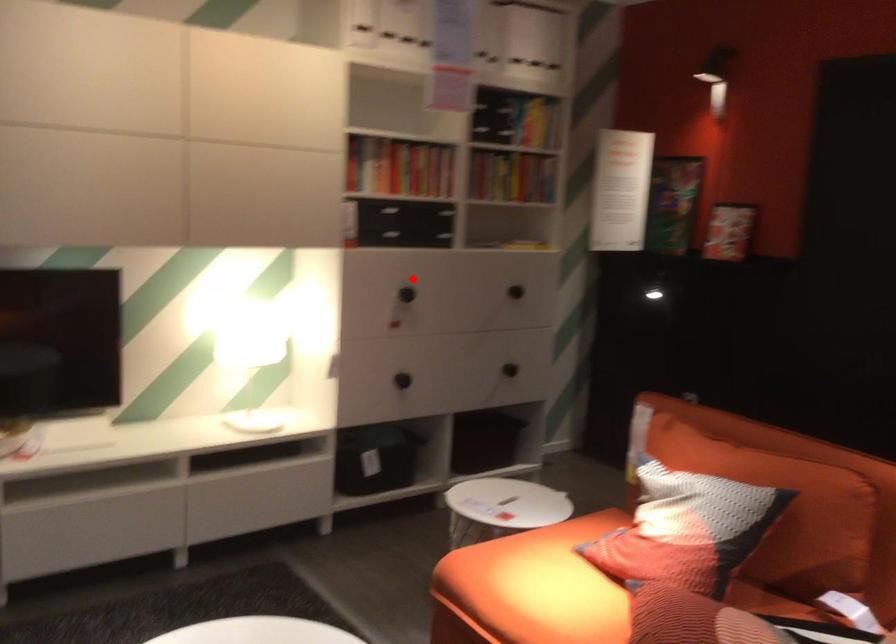
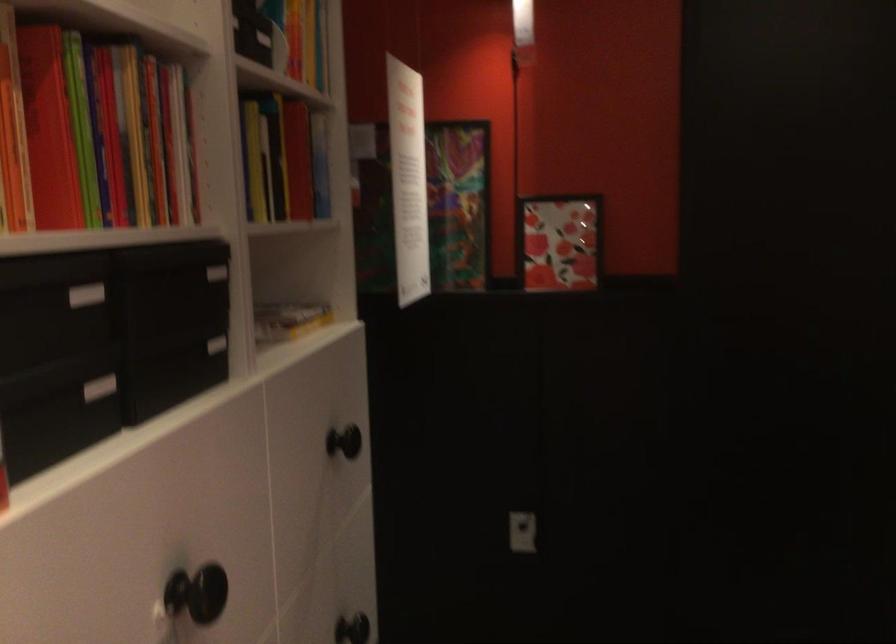
Find the pixel in the second image that matches the highlighted location in the first image.

(196, 592)